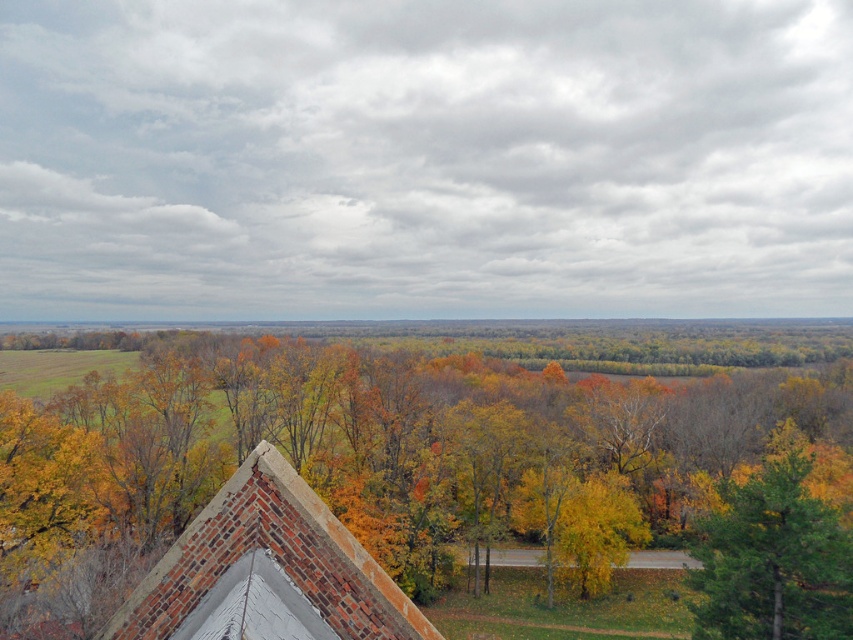
Question: Does yellow leaves at center appear over green matte tree at lower right?

Choices:
 (A) yes
 (B) no

Answer: (A)

Question: Which object appears closest to the camera in this image?

Choices:
 (A) brick at center
 (B) green matte tree at lower right
 (C) yellow leaves at center

Answer: (A)

Question: Can you confirm if brick at center is smaller than green matte tree at lower right?

Choices:
 (A) no
 (B) yes

Answer: (B)

Question: Where is yellow leaves at center located in relation to green matte tree at lower right in the image?

Choices:
 (A) left
 (B) right

Answer: (A)

Question: Among these points, which one is farthest from the camera?

Choices:
 (A) (183, 548)
 (B) (740, 499)
 (C) (602, 554)

Answer: (C)

Question: Which is farther from the green matte tree at lower right?

Choices:
 (A) brick at center
 (B) yellow leaves at center

Answer: (A)